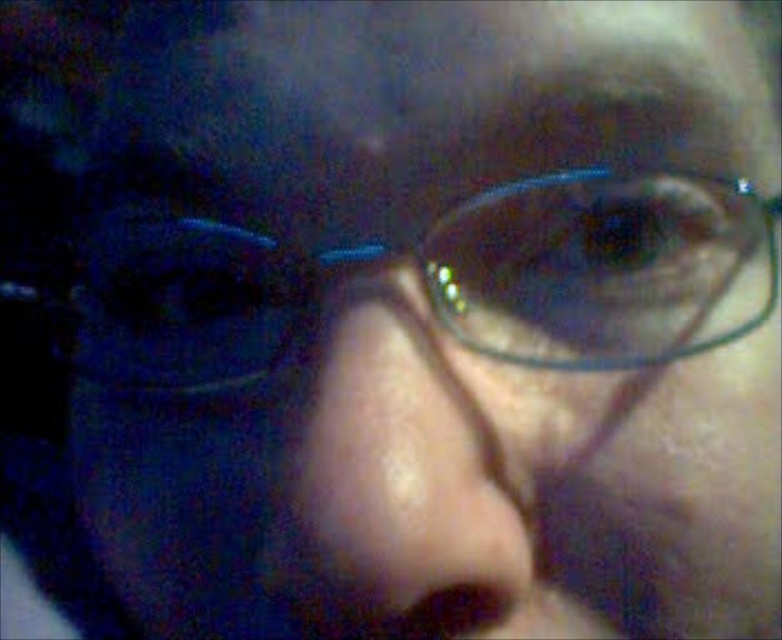
Question: From the image, what is the correct spatial relationship of clear plastic glasses at center in relation to smooth skin nose at center?

Choices:
 (A) right
 (B) left

Answer: (B)

Question: Which object appears closest to the camera in this image?

Choices:
 (A) smooth skin nose at center
 (B) clear plastic glasses at center

Answer: (A)

Question: Is clear plastic glasses at center thinner than smooth skin nose at center?

Choices:
 (A) no
 (B) yes

Answer: (A)

Question: Is clear plastic glasses at center wider than smooth skin nose at center?

Choices:
 (A) yes
 (B) no

Answer: (A)